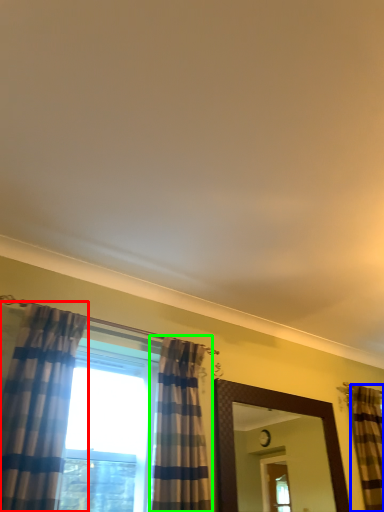
Question: Which object is the farthest from curtain (highlighted by a red box)? Choose among these: curtain (highlighted by a blue box) or curtain (highlighted by a green box).

Choices:
 (A) curtain
 (B) curtain

Answer: (A)